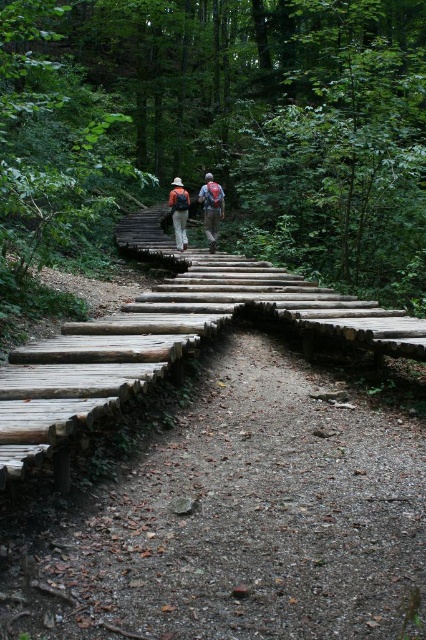
You are a hiker planning to cross the natural wood bridge at center while carrying your matte brown backpack at center. Based on the scene, can you determine if the bridge can support the weight of your backpack?

The natural wood bridge at center has a smaller size compared to matte brown backpack at center, which might indicate that the bridge may not be able to support the weight of the backpack. It is advisable to check the bridge for sturdiness before proceeding.

You are a hiker planning to place a small first aid kit on the wooden boardwalk path. The boardwalk is 1 meter wide. The point marked at coordinates (212, 209) is where the matte brown backpacks at center are located. If you want to place the first aid kit 0.5 meters away from the backpacks, will it be within the boardwalk?

The point marked at coordinates (212, 209) is where the matte brown backpacks at center are located. Since the boardwalk is 1 meter wide, placing the first aid kit 0.5 meters away from the backpacks would still be within the boardwalk as it is less than half the width of the path.